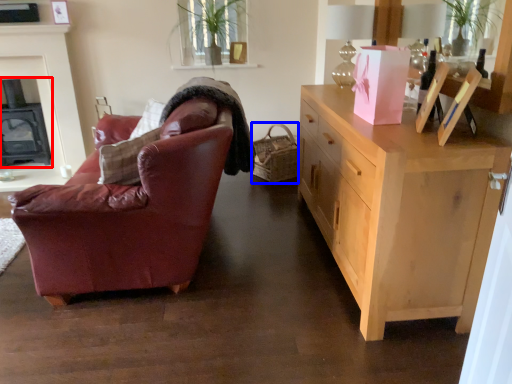
Question: Which of the following is the closest to the observer, fireplace (highlighted by a red box) or picnic basket (highlighted by a blue box)?

Choices:
 (A) fireplace
 (B) picnic basket

Answer: (B)